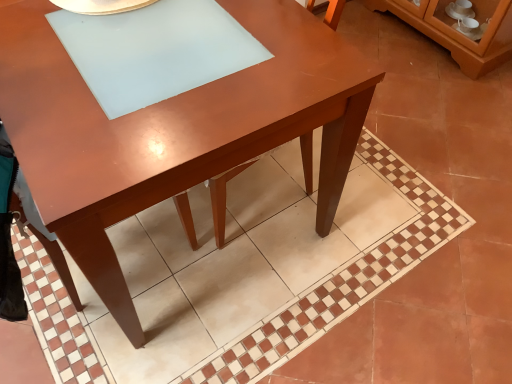
What are the coordinates of `free point in front of brown glossy cabinet at upper right` in the screenshot? It's located at (435, 89).